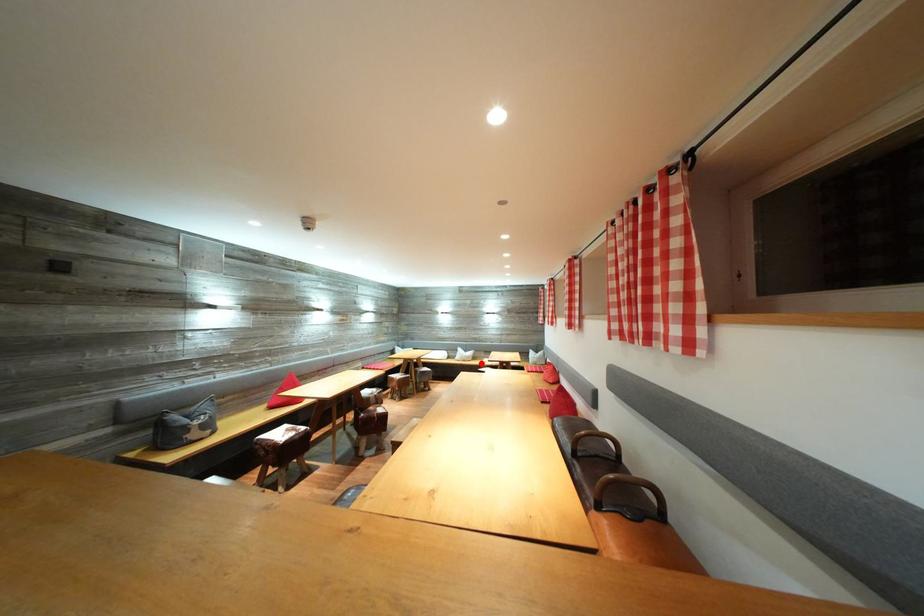
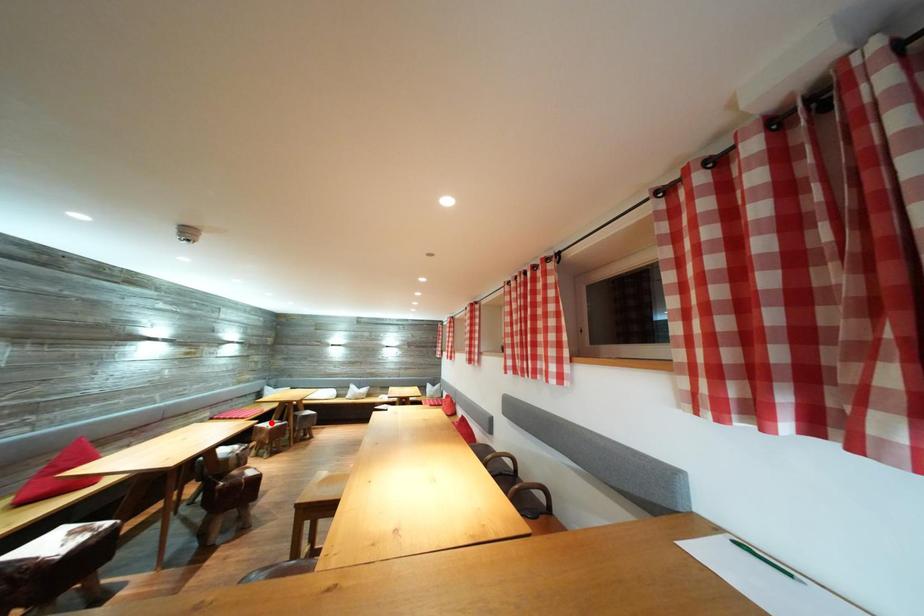
I am providing you with two images of the same scene from different viewpoints. A red point is marked on the first image and another point is marked on the second image. Is the red point in image1 aligned with the point shown in image2?

No